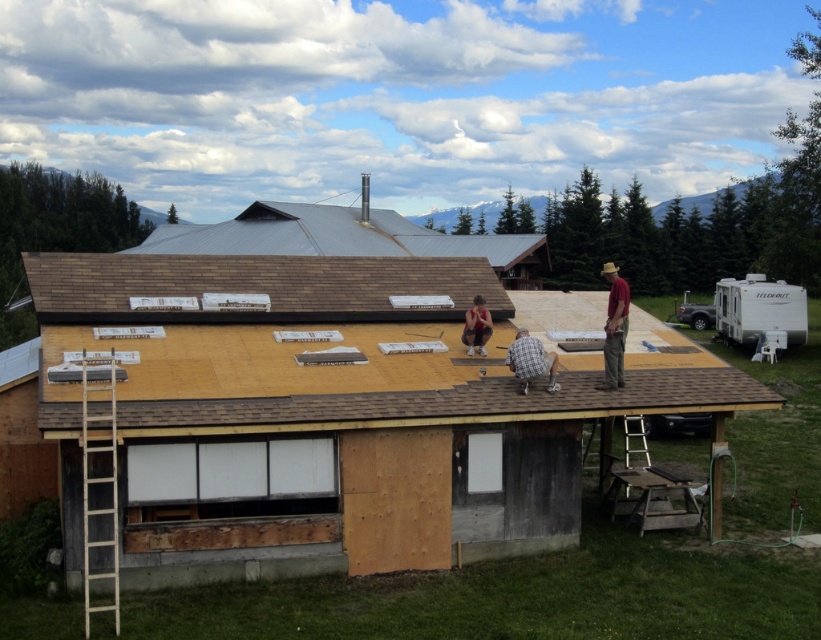
Is point (320, 291) farther from viewer compared to point (108, 468)?

Yes, it is behind point (108, 468).

Does point (433, 282) lie in front of point (93, 435)?

No.

Identify the location of brown shingles at upper center. (255, 285).

Is metallic gray roof at upper center smaller than matte black shorts at center?

No, metallic gray roof at upper center is not smaller than matte black shorts at center.

Is point (388, 243) farther from viewer compared to point (484, 332)?

Yes, point (388, 243) is farther from viewer.

The width and height of the screenshot is (821, 640). I want to click on metallic gray roof at upper center, so click(342, 236).

Who is positioned more to the left, red cotton shirt at center or matte black shorts at center?

Positioned to the left is matte black shorts at center.

Which is in front, point (613, 300) or point (475, 346)?

Point (613, 300)

Which is in front, point (609, 381) or point (480, 316)?

Point (609, 381) is more forward.

Locate an element on the screen. The height and width of the screenshot is (640, 821). red cotton shirt at center is located at coordinates (613, 326).